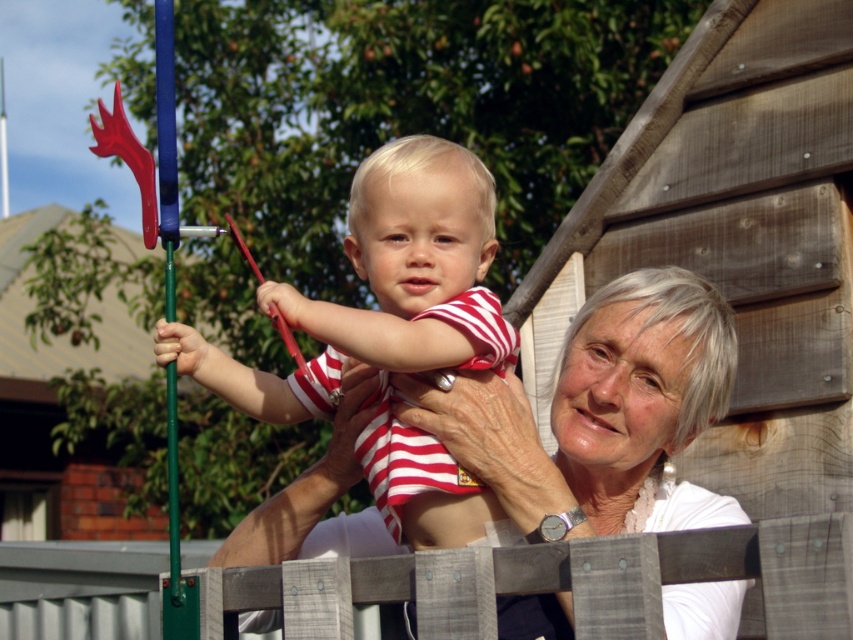
Question: Does white matte/soft skin at center appear over wooden fence at center?

Choices:
 (A) yes
 (B) no

Answer: (A)

Question: Which object is closer to the camera taking this photo?

Choices:
 (A) white matte/soft skin at center
 (B) striped cotton shirt at center
 (C) wooden fence at center

Answer: (C)

Question: From the image, what is the correct spatial relationship of white matte/soft skin at center in relation to striped cotton shirt at center?

Choices:
 (A) left
 (B) right

Answer: (B)

Question: Which point is farther to the camera?

Choices:
 (A) (202, 368)
 (B) (270, 518)

Answer: (B)

Question: Does white matte/soft skin at center have a greater width compared to wooden fence at center?

Choices:
 (A) yes
 (B) no

Answer: (A)

Question: Which point appears farthest from the camera in this image?

Choices:
 (A) (102, 621)
 (B) (316, 413)

Answer: (A)